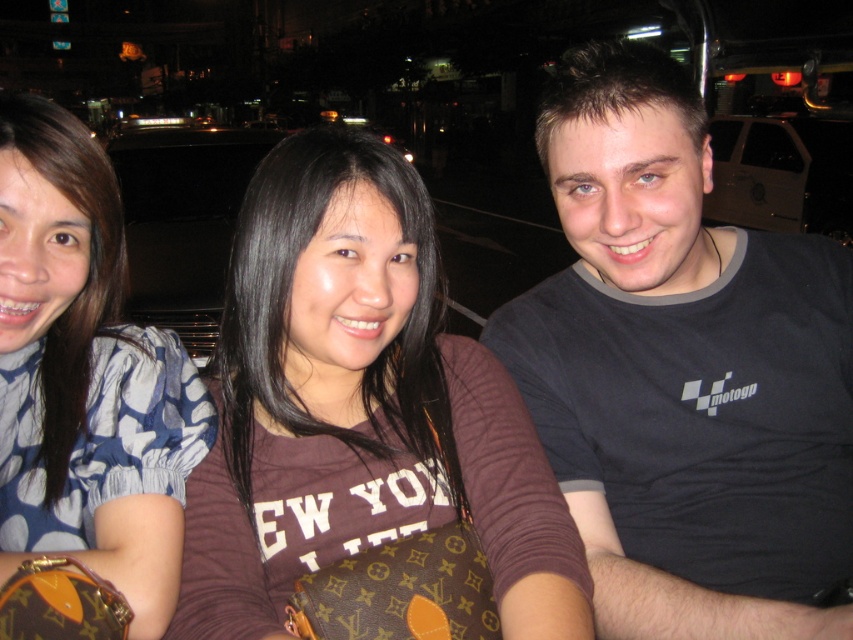
In the scene shown: You are a photographer adjusting your camera settings to focus on two specific points in the image. The first point is at coordinates point [535,333] and the second is at point [138,452]. Which point should you focus on first to ensure the closest object is sharp?

Point [535,333] is further to the viewer than point [138,452], so you should focus on point [535,333] first to capture the closest object sharply.

You are a photographer who wants to focus on the brown fabric shirt at center. Given that the camera is currently focused at point (358,406), will the center individual wearing a maroon long sleeved shirt with NEW YORK printed on it be in focus?

The point (358,406) corresponds to the brown fabric shirt at center, so the center individual wearing a maroon long sleeved shirt with NEW YORK printed on it will not be in focus since the focus is on the brown fabric shirt at center.